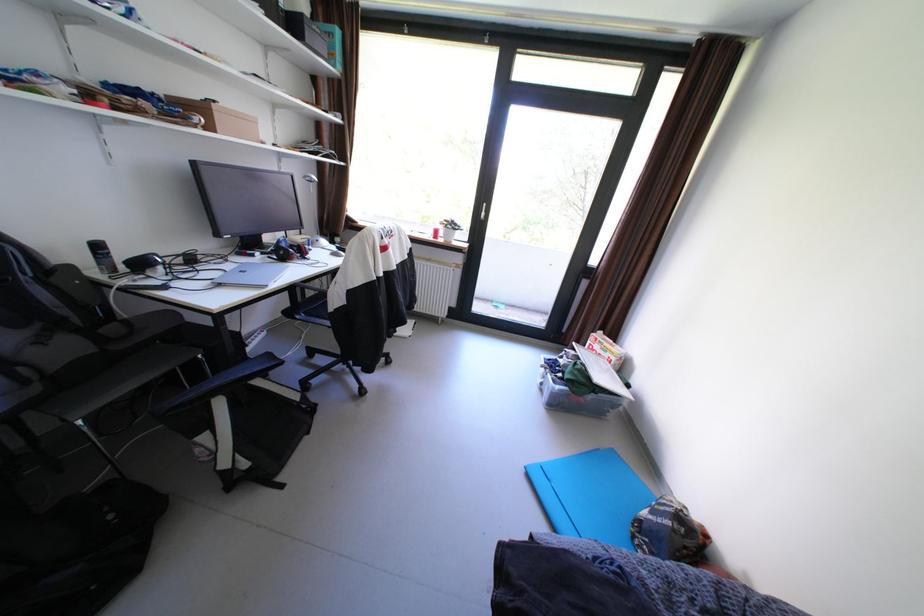
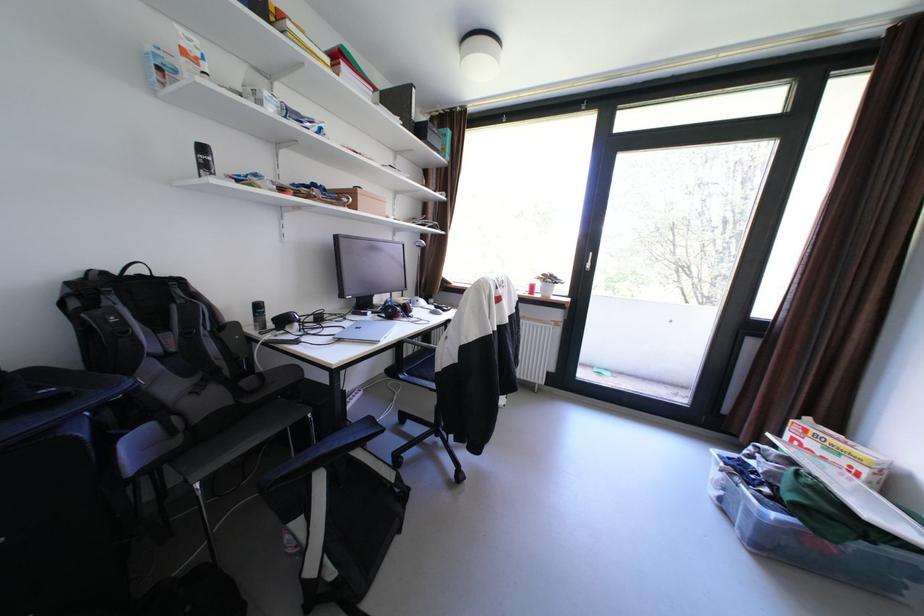
Find the pixel in the second image that matches (568,387) in the first image.

(784, 516)